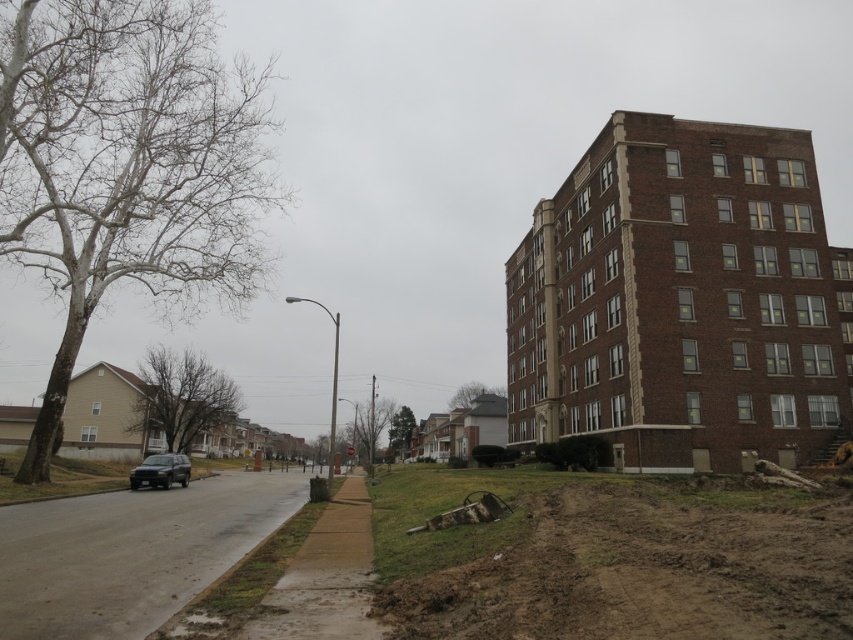
Which of these two, gray asphalt road at lower left or green matte tree at center, stands taller?

With more height is green matte tree at center.

Between gray asphalt road at lower left and green matte tree at center, which one is positioned higher?

gray asphalt road at lower left

Between point (7, 598) and point (451, 401), which one is positioned in front?

Point (7, 598) is in front.

This screenshot has height=640, width=853. In order to click on gray asphalt road at lower left in this screenshot , I will do `click(131, 552)`.

Is gray asphalt road at lower left to the right of brown leafless tree at center from the viewer's perspective?

Indeed, gray asphalt road at lower left is positioned on the right side of brown leafless tree at center.

Who is taller, gray asphalt road at lower left or brown leafless tree at center?

With more height is brown leafless tree at center.

Describe the element at coordinates (131, 552) in the screenshot. I see `gray asphalt road at lower left` at that location.

Locate an element on the screen. Image resolution: width=853 pixels, height=640 pixels. gray asphalt road at lower left is located at coordinates (131, 552).

Who is positioned more to the right, brown leafless tree at center-left or green leafy tree at center?

From the viewer's perspective, green leafy tree at center appears more on the right side.

Image resolution: width=853 pixels, height=640 pixels. Find the location of `brown leafless tree at center-left`. brown leafless tree at center-left is located at coordinates (183, 397).

Is point (206, 397) in front of point (407, 428)?

Yes, point (206, 397) is closer to viewer.

The height and width of the screenshot is (640, 853). What are the coordinates of `brown leafless tree at center-left` in the screenshot? It's located at (183, 397).